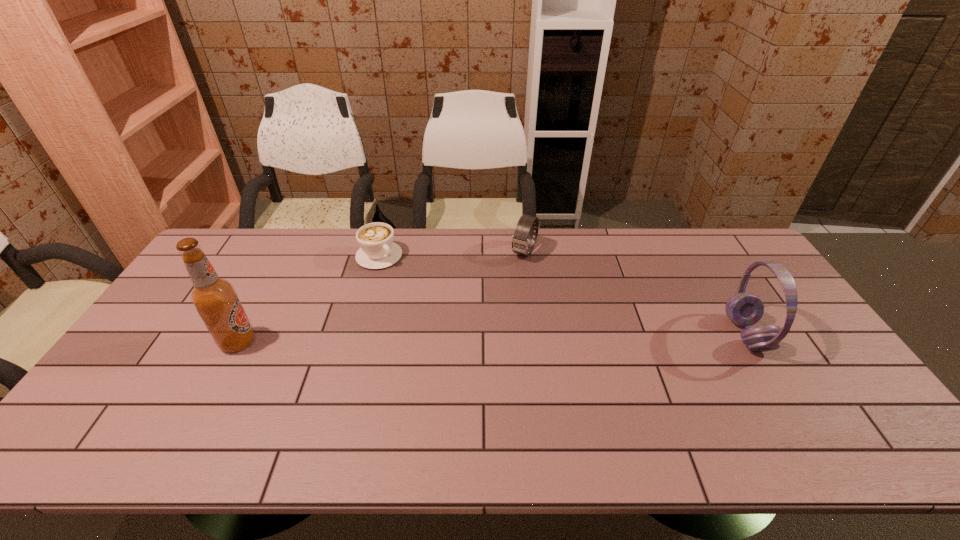
At what (x,y) coordinates should I click in order to perform the action: click on vacant region located on the headband and ear cups of the rightmost object. Please return your answer as a coordinate pair (x, y). The image size is (960, 540). Looking at the image, I should click on (644, 334).

The image size is (960, 540). I want to click on free point located 0.150m on the headband and ear cups of the rightmost object, so click(676, 334).

You are a GUI agent. You are given a task and a screenshot of the screen. Output one action in this format:
    pyautogui.click(x=<x>, y=<y>)
    Task: Click on the free spot located to the right of the cappuccino's handle
    Image resolution: width=960 pixels, height=540 pixels.
    Given the screenshot: What is the action you would take?
    pyautogui.click(x=404, y=277)

Where is `free space located 0.200m to the right of the cappuccino's handle`? The image size is (960, 540). free space located 0.200m to the right of the cappuccino's handle is located at coordinates tap(427, 298).

The image size is (960, 540). Find the location of `vacant space located to the right of the cappuccino's handle`. vacant space located to the right of the cappuccino's handle is located at coordinates (420, 291).

Where is `free space located 0.120m on the face of the watch`? free space located 0.120m on the face of the watch is located at coordinates (507, 286).

Find the location of a particular element. free location located 0.190m on the face of the watch is located at coordinates (498, 300).

At what (x,y) coordinates should I click in order to perform the action: click on free region located 0.160m on the face of the watch. Please return your answer as a coordinate pair (x, y). The width and height of the screenshot is (960, 540). Looking at the image, I should click on (502, 293).

Where is `cappuccino that is at the far edge`? cappuccino that is at the far edge is located at coordinates (378, 250).

Locate an element on the screen. The height and width of the screenshot is (540, 960). watch at the far edge is located at coordinates (522, 239).